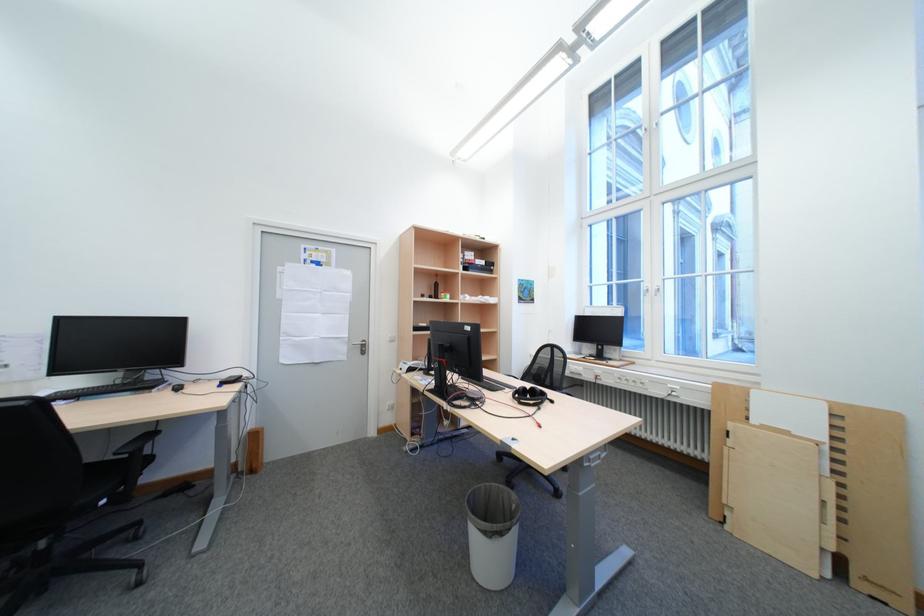
The width and height of the screenshot is (924, 616). I want to click on black headphones, so click(x=529, y=395).